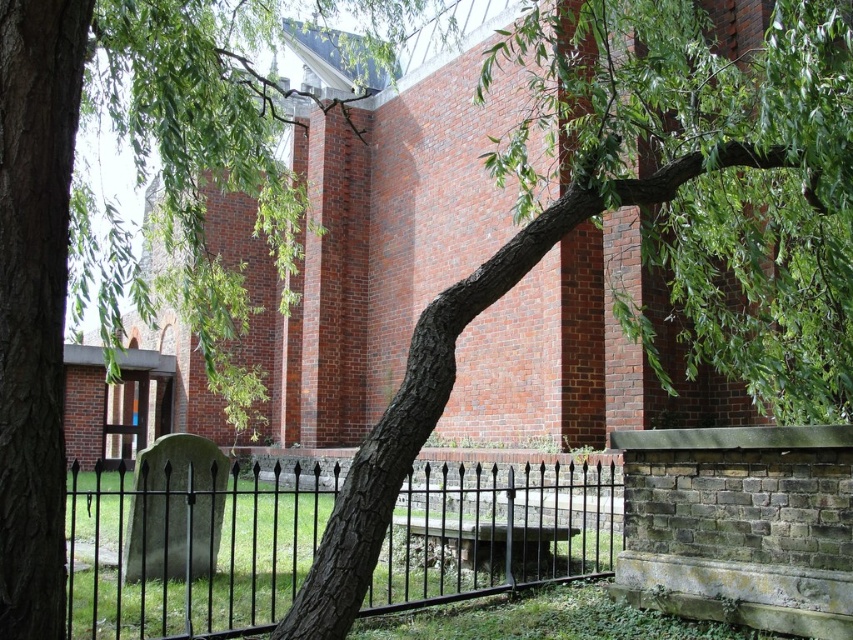
Question: Does green leafy branch at center lie behind black wrought iron fence at center?

Choices:
 (A) yes
 (B) no

Answer: (B)

Question: Among these points, which one is farthest from the camera?

Choices:
 (A) (102, 468)
 (B) (567, 145)

Answer: (A)

Question: Estimate the real-world distances between objects in this image. Which object is farther from the black wrought iron fence at center?

Choices:
 (A) smooth bark tree at center
 (B) green leafy branch at center

Answer: (B)

Question: Where is green leafy branch at center located in relation to smooth bark tree at center in the image?

Choices:
 (A) above
 (B) below

Answer: (B)

Question: Which object is positioned closest to the black wrought iron fence at center?

Choices:
 (A) smooth bark tree at center
 (B) green leafy branch at center

Answer: (A)

Question: Can you confirm if smooth bark tree at center is positioned to the left of black wrought iron fence at center?

Choices:
 (A) no
 (B) yes

Answer: (A)